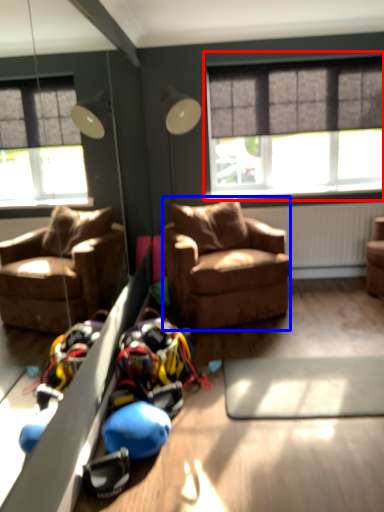
Question: Among these objects, which one is farthest to the camera, window (highlighted by a red box) or studio couch (highlighted by a blue box)?

Choices:
 (A) window
 (B) studio couch

Answer: (A)